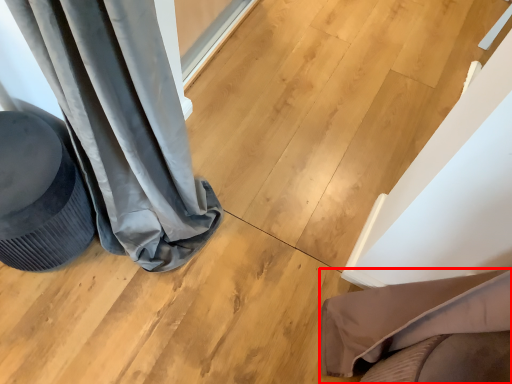
Question: From the image's perspective, considering the relative positions of furniture (annotated by the red box) and swivel chair in the image provided, where is furniture (annotated by the red box) located with respect to the staircase?

Choices:
 (A) below
 (B) above

Answer: (A)